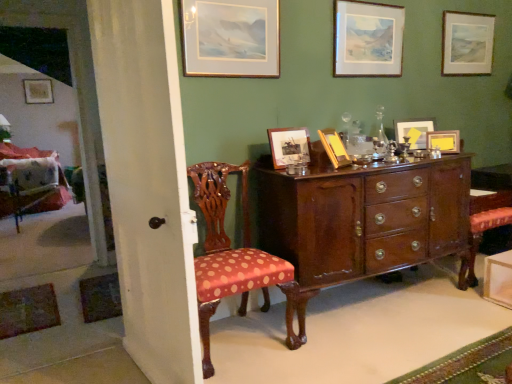
The width and height of the screenshot is (512, 384). I want to click on unoccupied area in front of wooden picture frame at center, arranged as the fifth picture frame when viewed from the right, so click(338, 170).